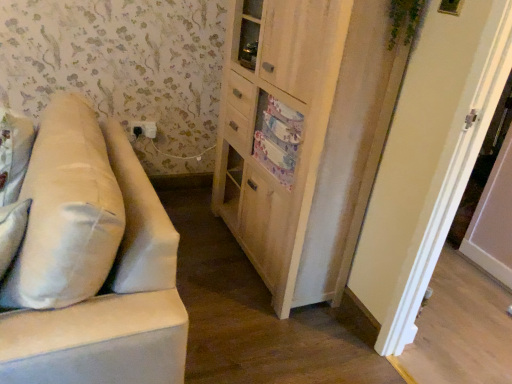
Question: From the image's perspective, is wooden cabinet at center over white fabric pillow at left?

Choices:
 (A) yes
 (B) no

Answer: (A)

Question: Is wooden cabinet at center at the left side of white fabric pillow at left?

Choices:
 (A) no
 (B) yes

Answer: (A)

Question: Is wooden cabinet at center looking in the opposite direction of white fabric pillow at left?

Choices:
 (A) yes
 (B) no

Answer: (B)

Question: Is wooden cabinet at center thinner than white fabric pillow at left?

Choices:
 (A) no
 (B) yes

Answer: (B)

Question: Does wooden cabinet at center lie behind white fabric pillow at left?

Choices:
 (A) no
 (B) yes

Answer: (B)

Question: Is wooden cabinet at center completely or partially outside of white fabric pillow at left?

Choices:
 (A) yes
 (B) no

Answer: (A)

Question: Can you confirm if white painted wood door at right is positioned to the right of white fabric pillow at left?

Choices:
 (A) no
 (B) yes

Answer: (B)

Question: Does white painted wood door at right have a greater height compared to white fabric pillow at left?

Choices:
 (A) yes
 (B) no

Answer: (A)

Question: Is white painted wood door at right not close to white fabric pillow at left?

Choices:
 (A) yes
 (B) no

Answer: (A)

Question: Is the depth of white painted wood door at right greater than that of white fabric pillow at left?

Choices:
 (A) yes
 (B) no

Answer: (A)

Question: From a real-world perspective, does white painted wood door at right sit lower than white fabric pillow at left?

Choices:
 (A) yes
 (B) no

Answer: (B)

Question: Is white fabric pillow at left inside white painted wood door at right?

Choices:
 (A) no
 (B) yes

Answer: (A)

Question: Does beige fabric couch at left touch white fabric pillow at left?

Choices:
 (A) yes
 (B) no

Answer: (A)